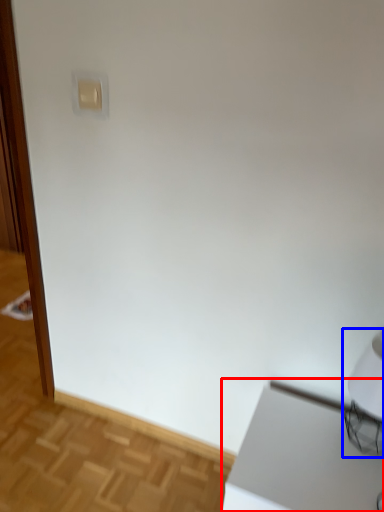
Question: Which point is further to the camera, table (highlighted by a red box) or table lamp (highlighted by a blue box)?

Choices:
 (A) table
 (B) table lamp

Answer: (B)